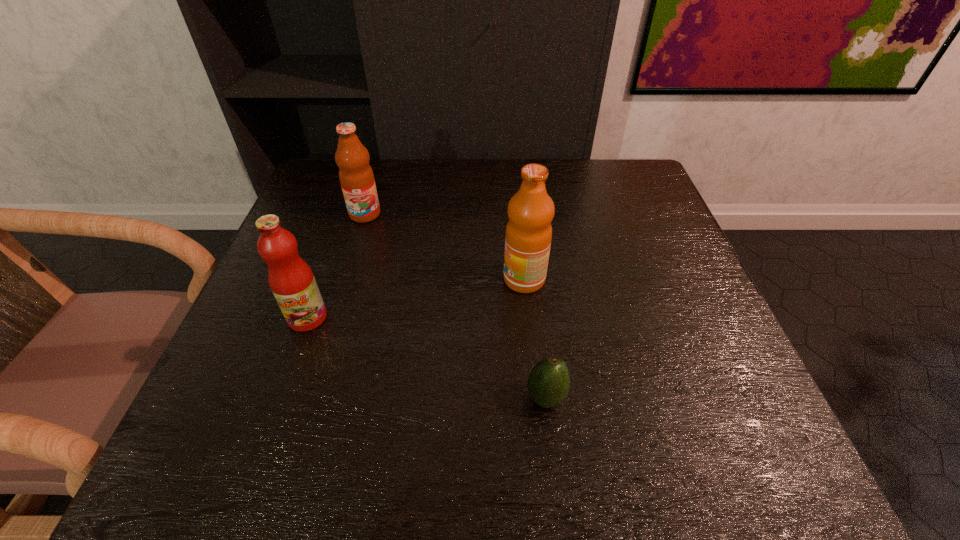
Where is `free space between the second farthest fruit juice and the nearest object`? free space between the second farthest fruit juice and the nearest object is located at coordinates (535, 339).

The image size is (960, 540). I want to click on vacant area that lies between the farthest fruit juice and the second nearest object, so click(x=336, y=266).

Where is `free point between the nearest object and the third farthest object`? free point between the nearest object and the third farthest object is located at coordinates (426, 357).

Identify the location of unoccupied position between the second farthest object and the nearest fruit juice. The height and width of the screenshot is (540, 960). (416, 299).

Where is `empty space that is in between the second nearest object and the avocado`? This screenshot has height=540, width=960. empty space that is in between the second nearest object and the avocado is located at coordinates coord(426,357).

At what (x,y) coordinates should I click in order to perform the action: click on free area in between the farthest fruit juice and the shortest object. Please return your answer as a coordinate pair (x, y). The image size is (960, 540). Looking at the image, I should click on (455, 306).

The height and width of the screenshot is (540, 960). In order to click on free space between the third nearest object and the farthest object in this screenshot , I will do (444, 247).

The image size is (960, 540). Find the location of `vacant space in between the farthest fruit juice and the second farthest object`. vacant space in between the farthest fruit juice and the second farthest object is located at coordinates (444, 247).

Identify the location of free space between the farthest object and the second nearest fruit juice. (444, 247).

Locate an element on the screen. object that is the closest to the nearest object is located at coordinates (528, 236).